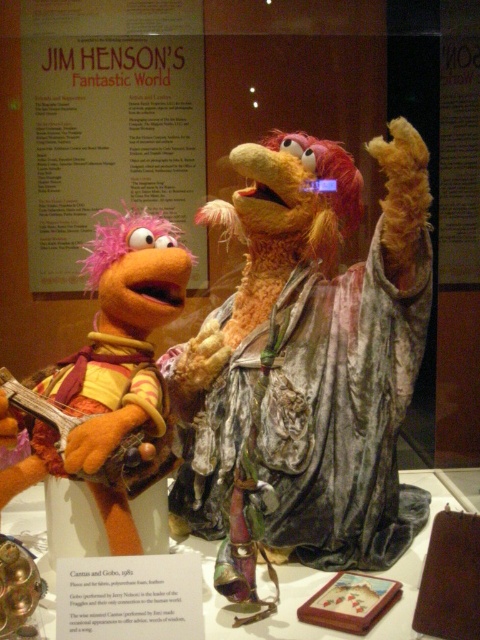
Which of these two, velvet-like robe at center or orange plush puppet at left, stands shorter?

Standing shorter between the two is orange plush puppet at left.

Can you confirm if velvet-like robe at center is shorter than orange plush puppet at left?

No.

Is point (216, 509) in front of point (157, 259)?

No, (216, 509) is behind (157, 259).

This screenshot has width=480, height=640. I want to click on velvet-like robe at center, so click(x=305, y=365).